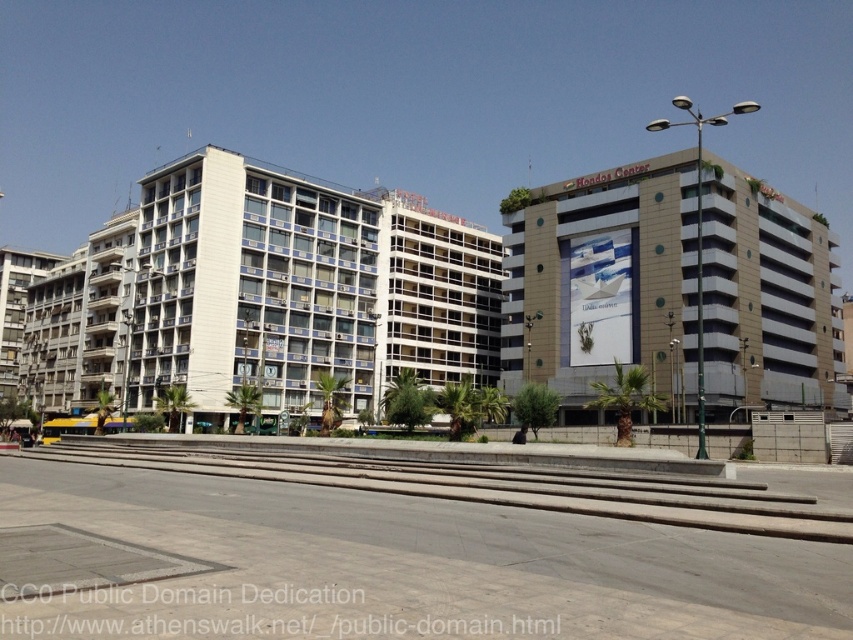
Question: Can you confirm if white concrete building at center is thinner than gray concrete train track at lower center?

Choices:
 (A) no
 (B) yes

Answer: (A)

Question: Which object is closer to the camera taking this photo?

Choices:
 (A) white concrete building at center
 (B) beige concrete building at upper right
 (C) gray concrete train track at lower center

Answer: (C)

Question: Is white concrete building at center below beige concrete building at upper right?

Choices:
 (A) yes
 (B) no

Answer: (A)

Question: Which point appears closest to the camera in this image?

Choices:
 (A) (607, 500)
 (B) (206, 237)
 (C) (728, 179)

Answer: (A)

Question: Where is white concrete building at center located in relation to gray concrete train track at lower center in the image?

Choices:
 (A) above
 (B) below

Answer: (A)

Question: Which object is closer to the camera taking this photo?

Choices:
 (A) beige concrete building at upper right
 (B) white concrete building at center
 (C) gray concrete train track at lower center

Answer: (C)